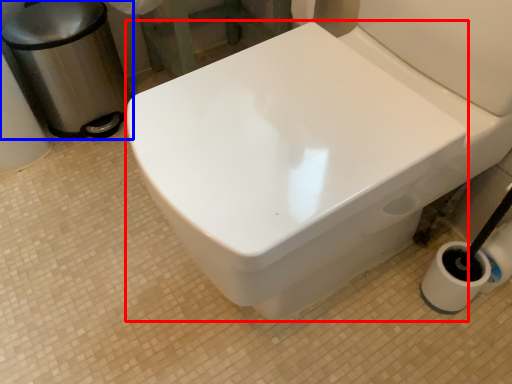
Question: Which point is further to the camera, bidet (highlighted by a red box) or garbage (highlighted by a blue box)?

Choices:
 (A) bidet
 (B) garbage

Answer: (B)